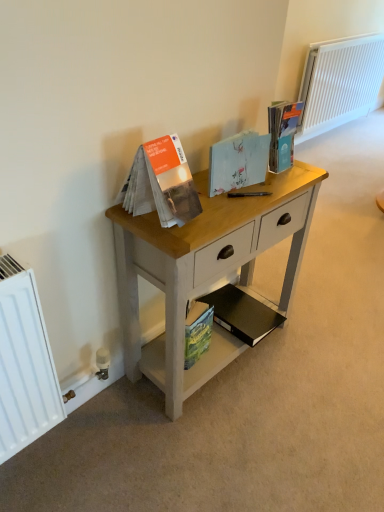
Find the location of a particular element. free space in front of matte blue paperback book at upper right, the 1th paperback book viewed from the top is located at coordinates (278, 185).